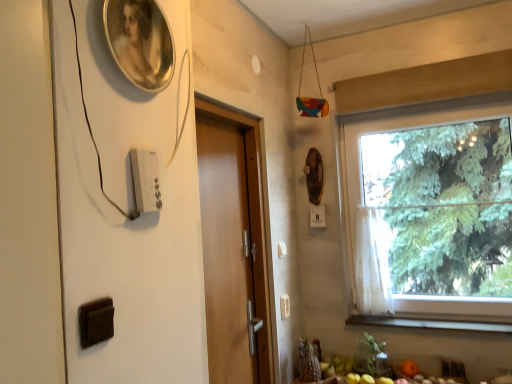
Question: Is white sheer curtain at window wider or thinner than wooden door at center?

Choices:
 (A) wide
 (B) thin

Answer: (A)

Question: From the image's perspective, is white sheer curtain at window above or below wooden door at center?

Choices:
 (A) above
 (B) below

Answer: (B)

Question: Based on their relative distances, which object is nearer to the white plastic light switch at center, acting as the first light switch starting from the back?

Choices:
 (A) white sheer curtain at window
 (B) wooden door at center
 (C) wooden at lower right
 (D) transparent glass window at right
 (E) white plastic light switch at lower right, marked as the second light switch in a back-to-front arrangement

Answer: (A)

Question: Which object is the farthest from the white sheer curtain at window?

Choices:
 (A) white plastic light switch at lower right, the 1th light switch ordered from the bottom
 (B) white plastic light switch at upper left, acting as the third light switch starting from the back
 (C) white plastic light switch at center, acting as the first light switch starting from the back
 (D) wooden door at center
 (E) transparent glass window at right

Answer: (B)